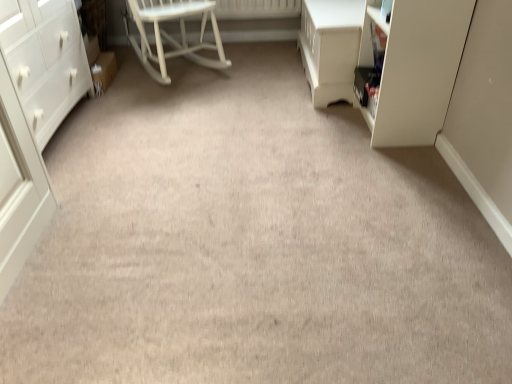
Find the location of a particular element. The image size is (512, 384). free space in front of matte white cabinet at right is located at coordinates (394, 162).